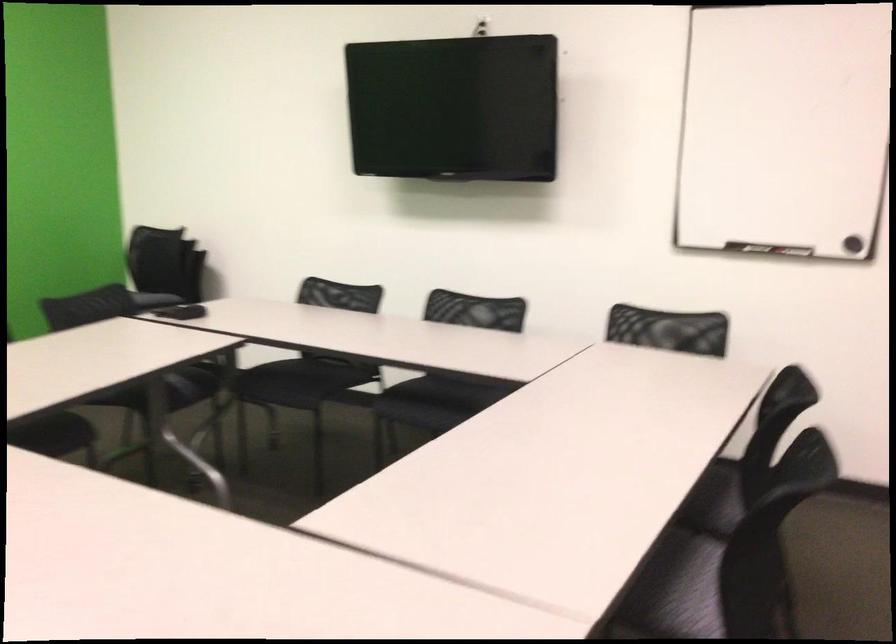
The images are taken continuously from a first-person perspective. In which direction is your viewpoint rotating?

The rotation direction of the camera is right-down.